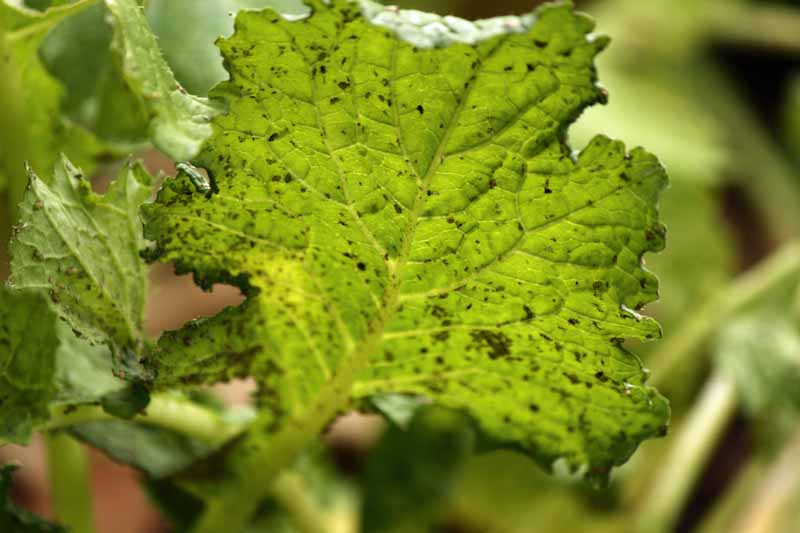
Where is `light`? light is located at coordinates (430, 26), (197, 23).